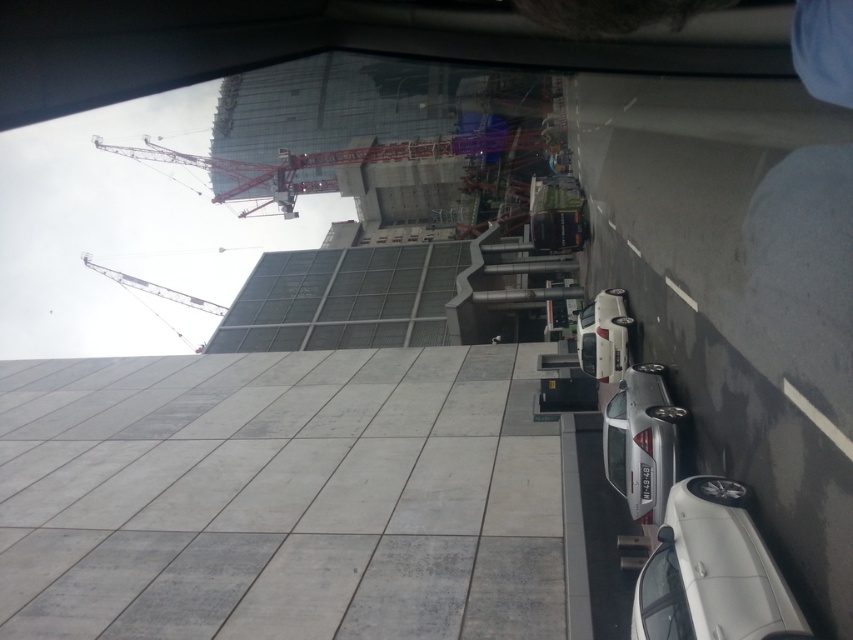
You are standing at the point marked as point (498, 140) in the image. The construction site is behind you. If you turn around, will you face the parked cars or the building under construction?

Since the construction site is behind you when you are at point (498, 140), turning around would face you towards the construction site, which is the building under construction.

You are a construction worker planning to move a heavy load from the red metal crane at upper center to the metallic gray crane at upper left. Considering their sizes, which crane can handle larger loads?

The metallic gray crane at upper left can handle larger loads since it is bigger than the red metal crane at upper center.